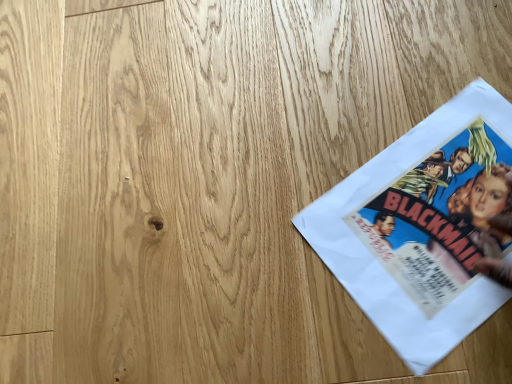
Where is `white paper at upper right`? Image resolution: width=512 pixels, height=384 pixels. white paper at upper right is located at coordinates (423, 227).

Describe the element at coordinates (423, 227) in the screenshot. The image size is (512, 384). I see `white paper at upper right` at that location.

Identify the location of white paper at upper right. The width and height of the screenshot is (512, 384). (423, 227).